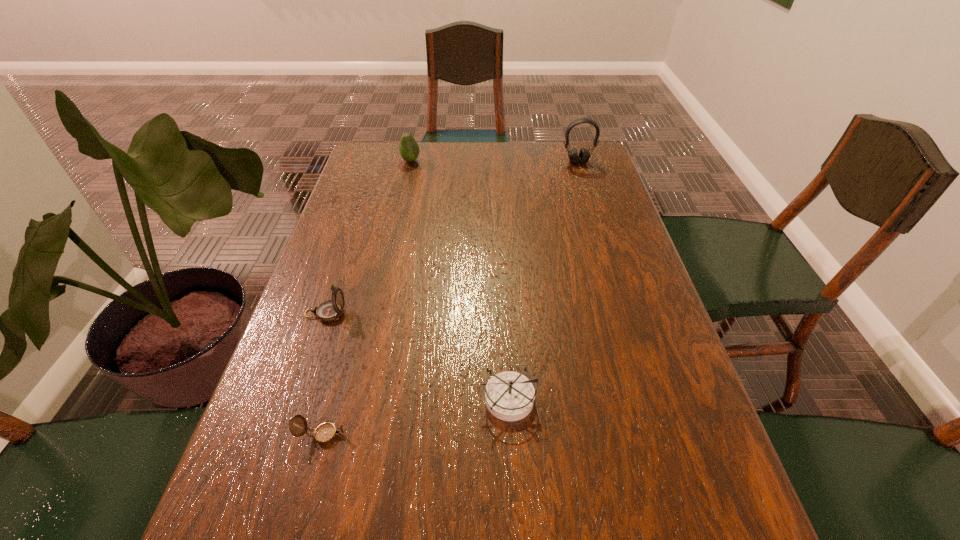
The width and height of the screenshot is (960, 540). Find the location of `free space between the avocado and the headset`. free space between the avocado and the headset is located at coordinates pyautogui.click(x=494, y=161).

Find the location of `vacant space that is in between the avocado and the second nearest compass`. vacant space that is in between the avocado and the second nearest compass is located at coordinates (459, 280).

At what (x,y) coordinates should I click in order to perform the action: click on empty location between the rightmost object and the second nearest compass. Please return your answer as a coordinate pair (x, y). The height and width of the screenshot is (540, 960). Looking at the image, I should click on (542, 280).

At what (x,y) coordinates should I click in order to perform the action: click on free space between the farthest compass and the headset. Please return your answer as a coordinate pair (x, y). The height and width of the screenshot is (540, 960). Looking at the image, I should click on (452, 238).

Locate an element on the screen. object identified as the closest to the shortest compass is located at coordinates (509, 396).

Choose which object is the second nearest neighbor to the nearest object. Please provide its 2D coordinates. Your answer should be formatted as a tuple, i.e. [(x, y)], where the tuple contains the x and y coordinates of a point satisfying the conditions above.

[(330, 310)]

Find the location of a particular element. compass identified as the closest to the second shortest compass is located at coordinates (325, 433).

Where is `compass that is the nearest to the rightmost object`? compass that is the nearest to the rightmost object is located at coordinates (509, 396).

This screenshot has width=960, height=540. What are the coordinates of `free space in the image that satisfies the following two spatial constraints: 1. on the front-facing side of the rightmost object; 2. on the face of the farthest compass` in the screenshot? It's located at (625, 313).

Where is `vacant area in the image that satisfies the following two spatial constraints: 1. on the face of the third nearest object; 2. on the right side of the second nearest compass`? The image size is (960, 540). vacant area in the image that satisfies the following two spatial constraints: 1. on the face of the third nearest object; 2. on the right side of the second nearest compass is located at coordinates (298, 399).